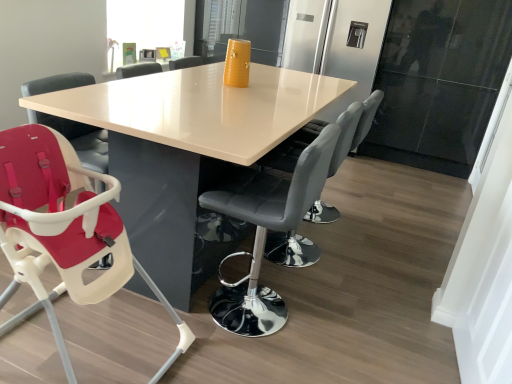
Question: From a real-world perspective, is transparent glass window screen at upper left above or below matte white highchair at lower left, positioned as the 1th chair in left-to-right order?

Choices:
 (A) below
 (B) above

Answer: (B)

Question: Is point tap(143, 28) closer or farther from the camera than point tap(55, 291)?

Choices:
 (A) closer
 (B) farther

Answer: (B)

Question: Which object is positioned closest to the transparent glass window screen at upper left?

Choices:
 (A) white glossy table at center
 (B) black leather bar stool at center, the 2th chair viewed from the right
 (C) matte black chair at center, placed as the third chair when sorted from left to right
 (D) matte white highchair at lower left, positioned as the third chair in right-to-left order

Answer: (A)

Question: Considering the real-world distances, which object is closest to the black leather bar stool at center, the 2th chair viewed from the right?

Choices:
 (A) matte black chair at center, which is counted as the 1th chair, starting from the right
 (B) matte white highchair at lower left, positioned as the third chair in right-to-left order
 (C) white glossy table at center
 (D) transparent glass window screen at upper left

Answer: (C)